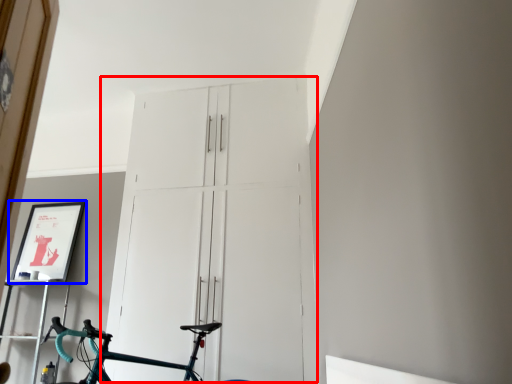
Question: Which point is further to the camera, door (highlighted by a red box) or picture frame (highlighted by a blue box)?

Choices:
 (A) door
 (B) picture frame

Answer: (B)